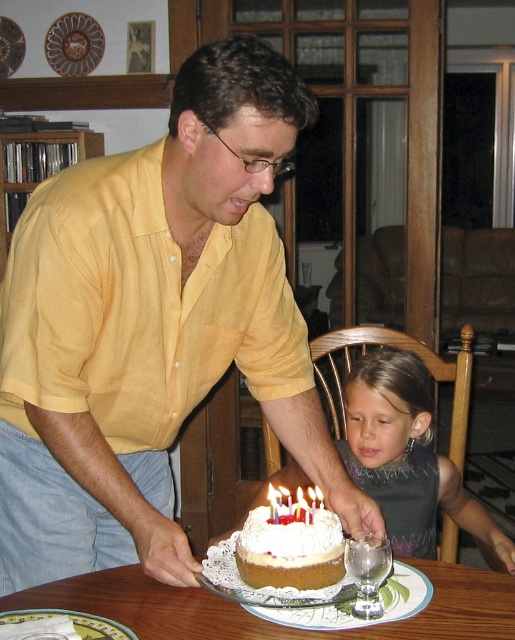
You are planning to pack a suitcase for a trip and have both the yellow cotton shirt at center and the smooth gray dress at center. Which one should you place first into the suitcase to save space?

The smooth gray dress at center should be placed first into the suitcase because it is smaller in size than the yellow cotton shirt at center, allowing more space for the larger item afterward.

You are standing in front of the table where the white frosted cake at center is placed. If you want to reach the cake without moving your feet, can you do it?

The white frosted cake at center is 1.05 meters from viewer, so if you can reach 1.05 meters without moving your feet, you can reach it. Otherwise, you might need to step closer.

You are standing in the room and want to reach the point marked as point (321, 522). If your arm can extend 1 meter, can you reach it without moving your feet?

The distance between you and point (321, 522) is 1.11 meters, which is beyond your arm reach of 1 meter. Therefore, you cannot reach it without moving your feet.